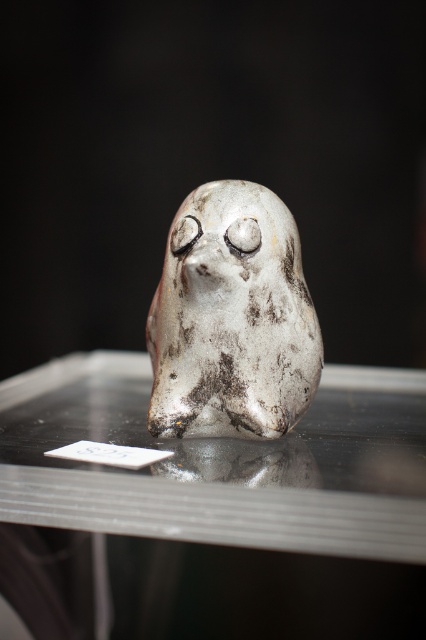
Can you confirm if transparent glass table at center is positioned below shiny metallic bird at center?

Indeed, transparent glass table at center is positioned under shiny metallic bird at center.

Is point (36, 433) positioned before point (314, 321)?

No, (36, 433) is further to viewer.

The width and height of the screenshot is (426, 640). What are the coordinates of `transparent glass table at center` in the screenshot? It's located at (215, 480).